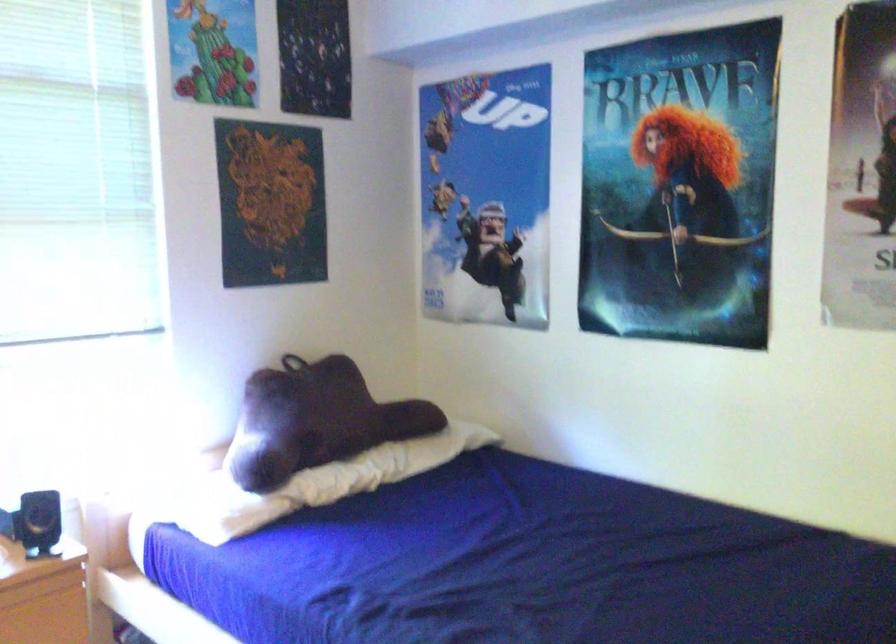
This screenshot has height=644, width=896. I want to click on pillow handle, so click(x=291, y=363).